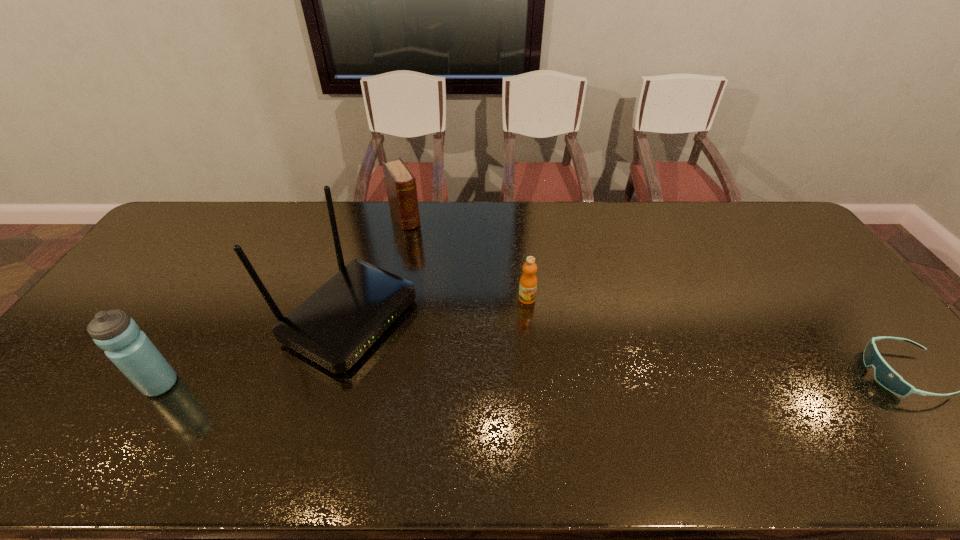
Locate an element on the screen. Image resolution: width=960 pixels, height=540 pixels. free space at the near edge of the desktop is located at coordinates (647, 404).

Where is `vacant space at the left edge of the desktop`? vacant space at the left edge of the desktop is located at coordinates (154, 311).

This screenshot has width=960, height=540. What are the coordinates of `vacant space at the far left corner of the desktop` in the screenshot? It's located at (229, 206).

You are a GUI agent. You are given a task and a screenshot of the screen. Output one action in this format:
    pyautogui.click(x=<x>, y=<y>)
    Task: Click on the blank region between the farthest object and the second object from right to left
    
    Given the screenshot: What is the action you would take?
    pyautogui.click(x=466, y=258)

What are the coordinates of `empty location between the farthest object and the second tallest object` in the screenshot? It's located at (283, 301).

The height and width of the screenshot is (540, 960). Identify the location of free area in between the tallest object and the second object from right to left. (438, 309).

The width and height of the screenshot is (960, 540). Find the location of `free spot between the orange juice and the router`. free spot between the orange juice and the router is located at coordinates (438, 309).

Where is `object that ranks as the closest to the second tallest object`? object that ranks as the closest to the second tallest object is located at coordinates (x=340, y=321).

In order to click on object that stands as the fourth closest to the water bottle in this screenshot , I will do `click(888, 378)`.